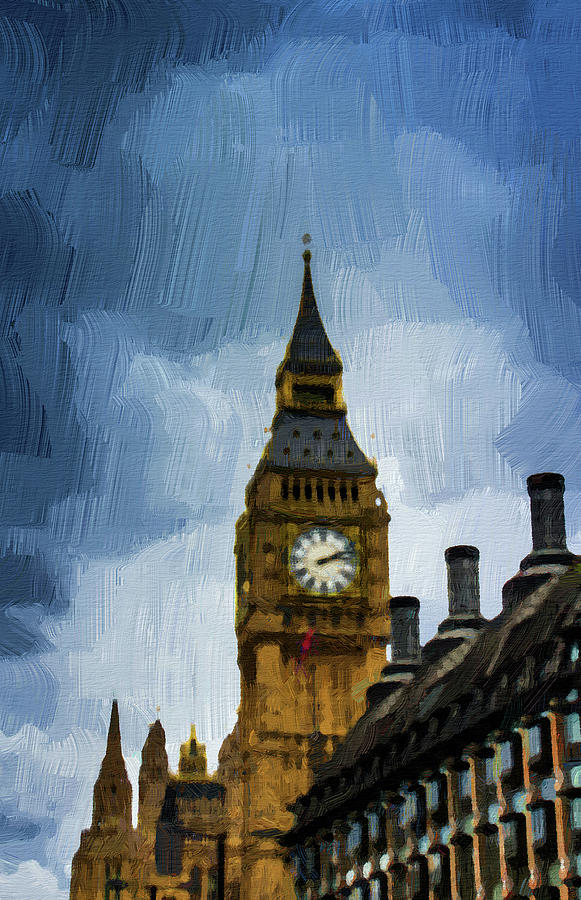
This screenshot has height=900, width=581. What are the coordinates of `clock` in the screenshot? It's located at (319, 554).